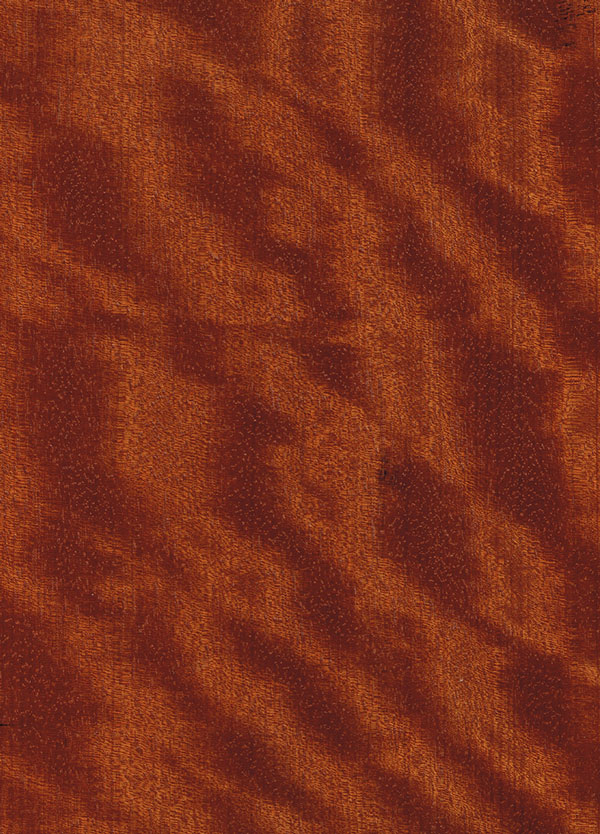
Where is `carpet`? The height and width of the screenshot is (834, 600). carpet is located at coordinates (279, 384).